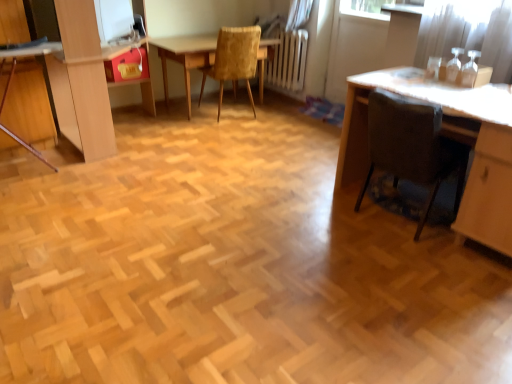
This screenshot has width=512, height=384. I want to click on vacant space in front of wooden table at center, so click(222, 137).